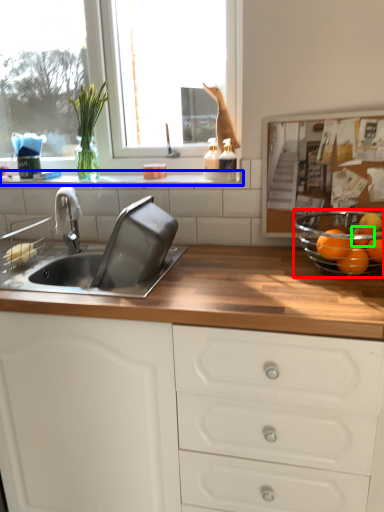
Question: Which is nearer to the glass bowl (highlighted by a red box)? window sill (highlighted by a blue box) or orange (highlighted by a green box).

Choices:
 (A) window sill
 (B) orange

Answer: (B)